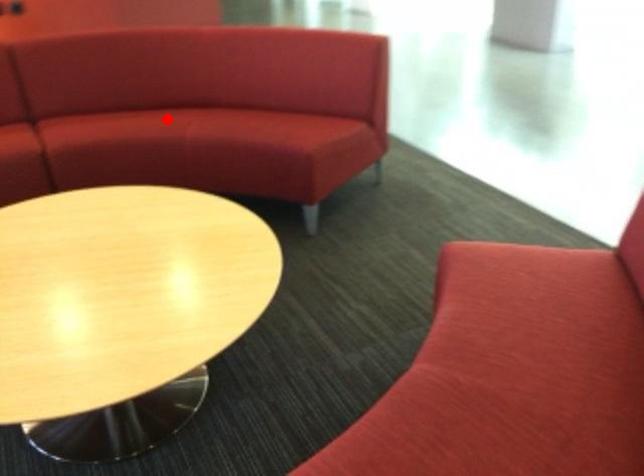
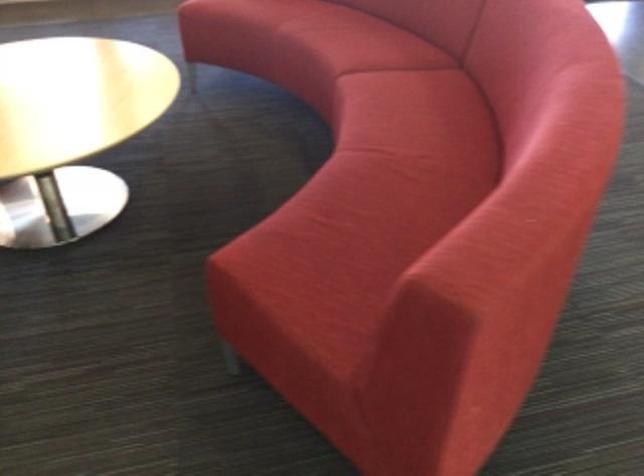
Question: A red point is marked in image1. In image2, is the corresponding 3D point closer to the camera or farther? Reply with the corresponding letter.

Choices:
 (A) The corresponding 3D point is closer.
 (B) The corresponding 3D point is farther.

Answer: (A)